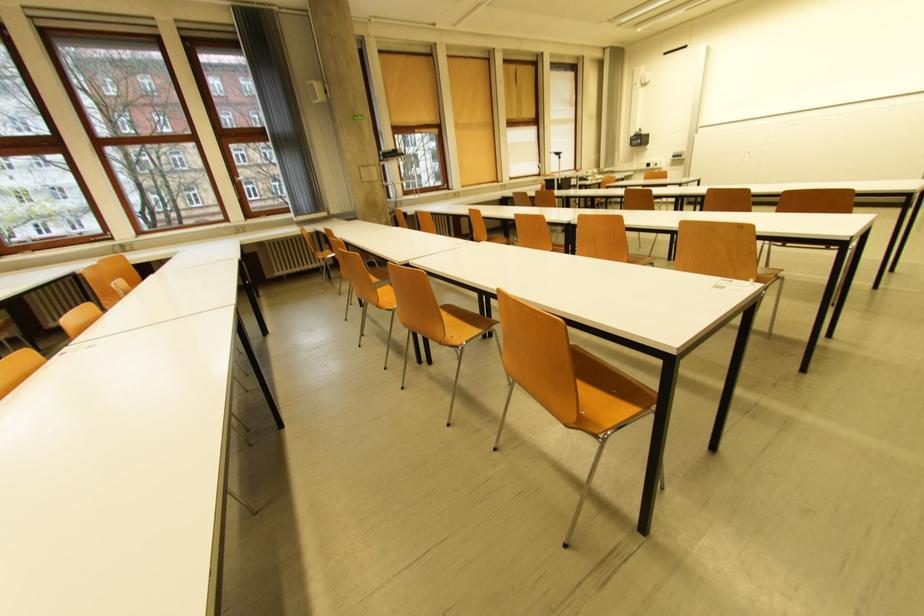
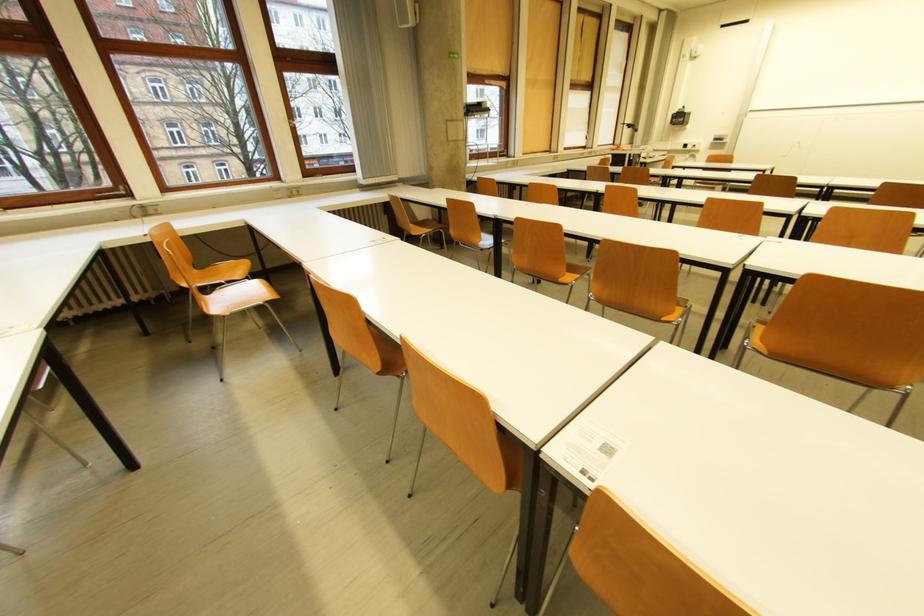
The point at (654, 167) is marked in the first image. Where is the corresponding point in the second image?

(691, 147)